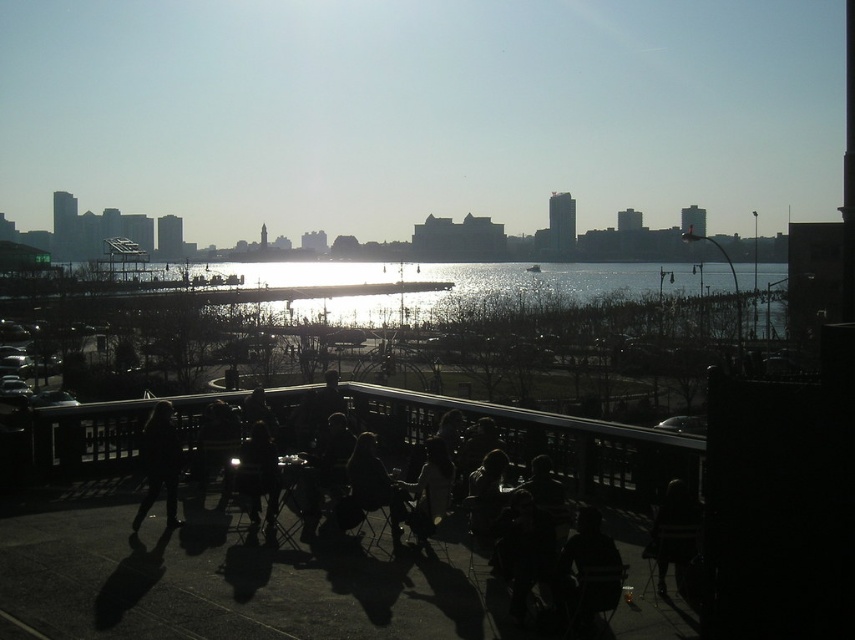
You are standing at the edge of the terrace and want to pick up the black leather jacket at lower left and the dark fabric chair at center. Which object is closer to you?

The black leather jacket at lower left is closer to you because it is further to the viewer than the dark fabric chair at center.

You are a guest at a restaurant overlooking the water. You want to take a photo of the silvery reflective water at center without the black metal rail at lower center appearing in the frame. Is it possible to adjust your position or angle to achieve this?

Yes, since the black metal rail at lower center is positioned under the silvery reflective water at center, you can adjust your angle or move to a position where the rail is out of the frame while still capturing the water.